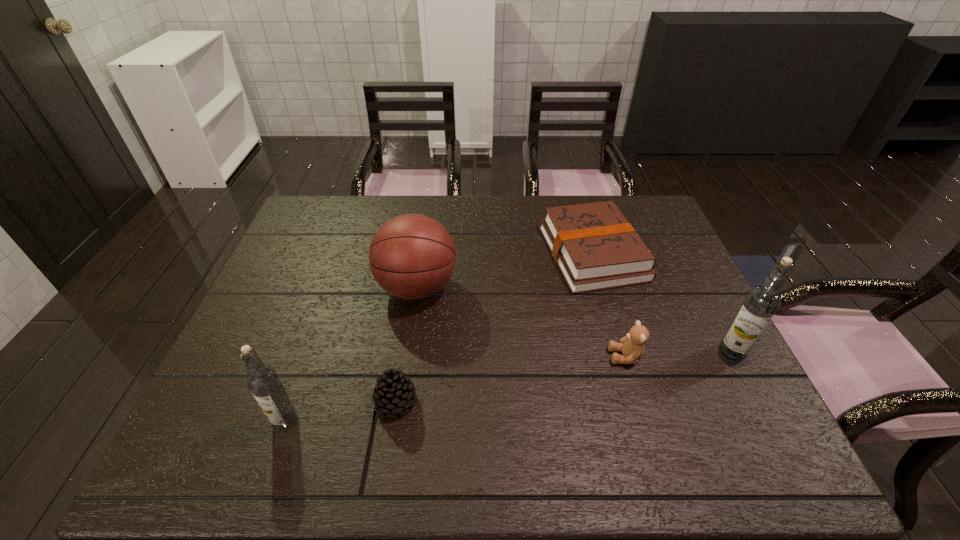
What are the coordinates of `the nearer vodka` in the screenshot? It's located at (263, 381).

The width and height of the screenshot is (960, 540). Find the location of `the left vodka`. the left vodka is located at coordinates (263, 381).

At what (x,y) coordinates should I click in order to perform the action: click on the taller vodka. Please return your answer as a coordinate pair (x, y). Looking at the image, I should click on (761, 303).

Locate an element on the screen. The height and width of the screenshot is (540, 960). the right vodka is located at coordinates (761, 303).

This screenshot has height=540, width=960. I want to click on basketball, so click(412, 256).

You are a GUI agent. You are given a task and a screenshot of the screen. Output one action in this format:
    pyautogui.click(x=<x>, y=<y>)
    Task: Click on the hardback book
    The image size is (960, 540).
    Given the screenshot: What is the action you would take?
    pyautogui.click(x=595, y=247)

The width and height of the screenshot is (960, 540). I want to click on teddy bear, so click(632, 347).

Locate an element on the screen. The height and width of the screenshot is (540, 960). pinecone is located at coordinates (394, 392).

Find the location of `free space located on the label of the nearer vodka`. free space located on the label of the nearer vodka is located at coordinates (245, 421).

Locate an element on the screen. free location located on the label of the nearer vodka is located at coordinates (245, 421).